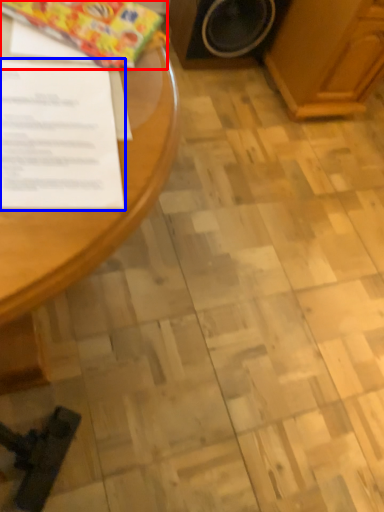
Question: Which point is further to the camera, wrapping paper (highlighted by a red box) or document (highlighted by a blue box)?

Choices:
 (A) wrapping paper
 (B) document

Answer: (A)